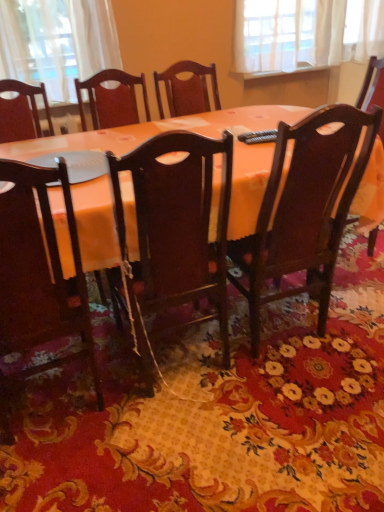
Question: Would you say polished dark wood chair at center, the first chair viewed from the right, is part of matte dark wood chair at lower left, the 3th chair in the right-to-left sequence,'s contents?

Choices:
 (A) yes
 (B) no

Answer: (B)

Question: Is matte dark wood chair at lower left, marked as the 1th chair in a left-to-right arrangement, at the left side of polished dark wood chair at center, acting as the 3th chair starting from the left?

Choices:
 (A) no
 (B) yes

Answer: (B)

Question: Is matte dark wood chair at lower left, the 3th chair in the right-to-left sequence, not near polished dark wood chair at center, the first chair viewed from the right?

Choices:
 (A) yes
 (B) no

Answer: (B)

Question: Would you say matte dark wood chair at lower left, the 3th chair in the right-to-left sequence, is outside polished dark wood chair at center, the first chair viewed from the right?

Choices:
 (A) no
 (B) yes

Answer: (B)

Question: From the image's perspective, is matte dark wood chair at lower left, the 3th chair in the right-to-left sequence, on top of polished dark wood chair at center, acting as the 3th chair starting from the left?

Choices:
 (A) no
 (B) yes

Answer: (A)

Question: Is polished dark wood chair at center, the first chair viewed from the right, wider or thinner than matte orange table at center?

Choices:
 (A) thin
 (B) wide

Answer: (A)

Question: From the image's perspective, is polished dark wood chair at center, the first chair viewed from the right, above or below matte orange table at center?

Choices:
 (A) below
 (B) above

Answer: (A)

Question: From a real-world perspective, relative to matte orange table at center, is polished dark wood chair at center, the first chair viewed from the right, vertically above or below?

Choices:
 (A) above
 (B) below

Answer: (A)

Question: Is point (344, 142) positioned closer to the camera than point (132, 198)?

Choices:
 (A) closer
 (B) farther

Answer: (B)

Question: From a real-world perspective, is matte dark wood chair at lower left, the 3th chair in the right-to-left sequence, positioned above or below polished dark wood chair at center, the first chair viewed from the right?

Choices:
 (A) below
 (B) above

Answer: (A)

Question: Considering the positions of point (34, 316) and point (276, 257), is point (34, 316) closer or farther from the camera than point (276, 257)?

Choices:
 (A) farther
 (B) closer

Answer: (B)

Question: In terms of width, does matte dark wood chair at lower left, the 3th chair in the right-to-left sequence, look wider or thinner when compared to polished dark wood chair at center, acting as the 3th chair starting from the left?

Choices:
 (A) wide
 (B) thin

Answer: (B)

Question: From the image's perspective, relative to polished dark wood chair at center, the first chair viewed from the right, is matte dark wood chair at lower left, the 3th chair in the right-to-left sequence, above or below?

Choices:
 (A) above
 (B) below

Answer: (B)

Question: Looking at the image, does matte orange table at center seem bigger or smaller compared to matte dark wood chair at lower left, the 3th chair in the right-to-left sequence?

Choices:
 (A) big
 (B) small

Answer: (A)

Question: From a real-world perspective, is matte orange table at center physically located above or below matte dark wood chair at lower left, marked as the 1th chair in a left-to-right arrangement?

Choices:
 (A) above
 (B) below

Answer: (B)